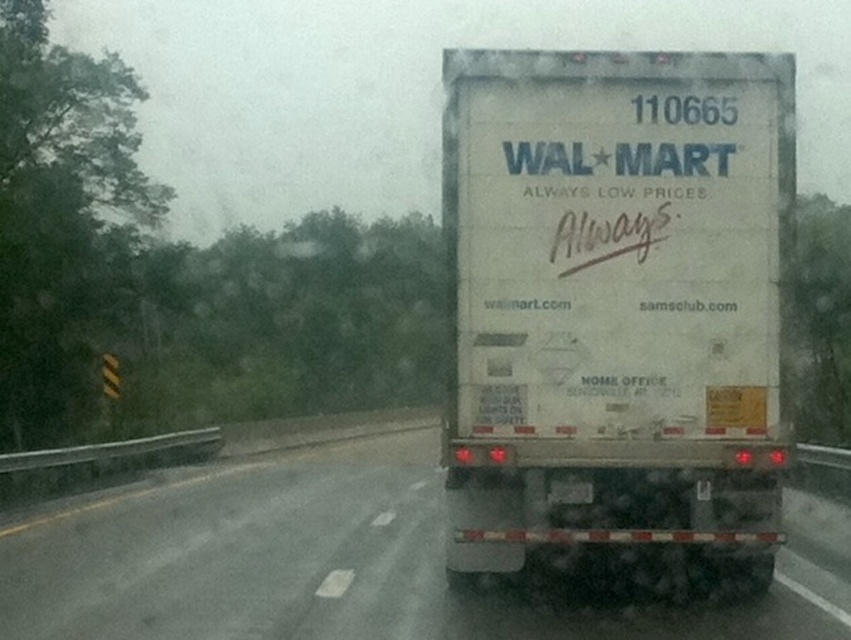
You are a delivery driver who needs to park the white matte trailer truck at center in a parking spot that is 30 feet away from the current position. Based on the scene, can you safely park the truck in the available spot without needing to move any other vehicles?

The white matte trailer truck at center is currently 26.56 feet away from the camera, so it is within the 30 feet distance required to park safely in the available spot without needing to move other vehicles.

You are a delivery driver who needs to pass under a low bridge that has a height limit of 10 feet. You are currently driving the white matte truck at center and see the white matte trailer truck at center attached to it. Will the entire setup fit under the bridge?

The white matte trailer truck at center is much taller than the white matte truck at center. Since the trailer truck is taller, the combined height of both vehicles might exceed the 10 feet limit, so it may not fit under the bridge.

You are standing at the point labeled as point (686, 388) and want to walk to the Walmart delivery truck. Given that the distance between you and the truck is 26.97 feet, will you have to walk more than 25 feet to reach it?

Yes, since the distance between point (686, 388) and the Walmart delivery truck is 26.97 feet, which is more than 25 feet, you will have to walk more than 25 feet to reach it.